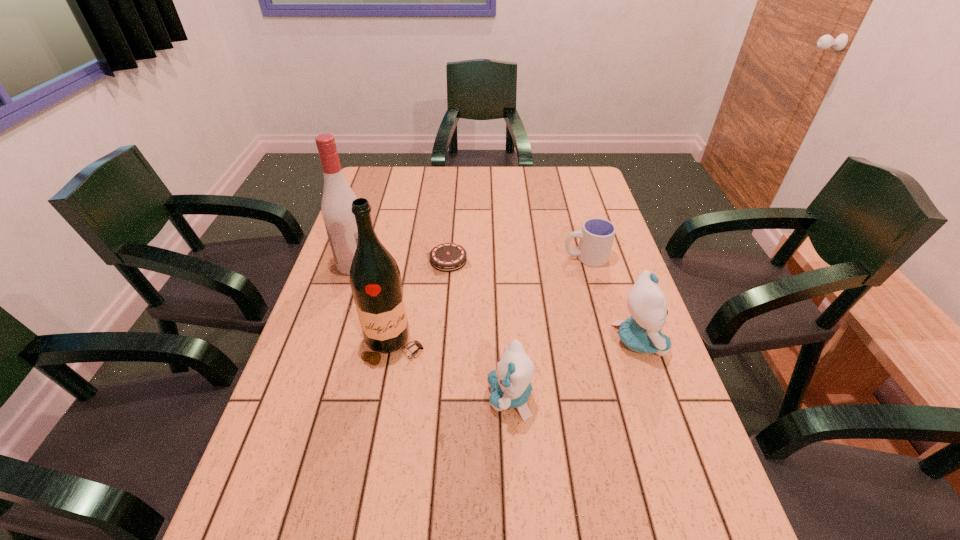
This screenshot has height=540, width=960. I want to click on free space located on the face of the third shortest object, so (x=461, y=397).

The image size is (960, 540). Identify the location of free space located 0.150m on the front of the wine bottle. (380, 426).

This screenshot has height=540, width=960. In order to click on vacant region located on the left of the shortest object in this screenshot , I will do `click(369, 260)`.

Identify the location of free location located with the handle on the side of the cup. (505, 258).

The height and width of the screenshot is (540, 960). What are the coordinates of `free region located with the handle on the side of the cup` in the screenshot? It's located at click(463, 258).

Identify the location of vacant region located 0.290m with the handle on the side of the cup. (469, 258).

Find the location of `vacant space situated 0.360m on the label of the alcohol`. vacant space situated 0.360m on the label of the alcohol is located at coordinates (492, 264).

At what (x,y) coordinates should I click in order to perform the action: click on wine bottle that is positioned at the left edge. Please return your answer as a coordinate pair (x, y). The width and height of the screenshot is (960, 540). Looking at the image, I should click on (375, 279).

Identify the location of alcohol that is at the left edge. (336, 207).

This screenshot has width=960, height=540. What are the coordinates of `kitten present at the right edge` in the screenshot? It's located at (641, 332).